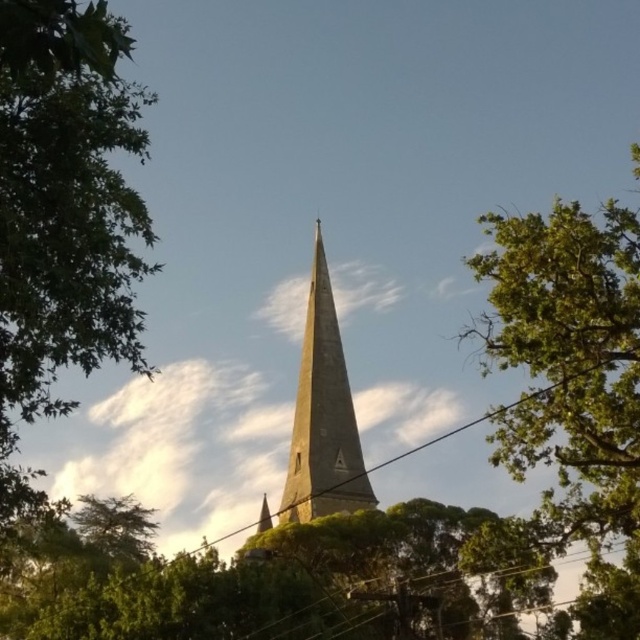
Question: Considering the real-world distances, which object is farthest from the smooth stone spire at center?

Choices:
 (A) green leafy tree at upper right
 (B) green leafy tree at left

Answer: (B)

Question: Based on their relative distances, which object is farther from the smooth stone spire at center?

Choices:
 (A) green leafy tree at upper right
 (B) green leafy tree at left

Answer: (B)

Question: Which point is farther from the camera taking this photo?

Choices:
 (A) (502, 237)
 (B) (58, 282)
 (C) (294, 445)

Answer: (C)

Question: Can you confirm if green leafy tree at left is wider than smooth stone spire at center?

Choices:
 (A) no
 (B) yes

Answer: (B)

Question: Can you confirm if green leafy tree at upper right is positioned to the left of smooth stone spire at center?

Choices:
 (A) no
 (B) yes

Answer: (A)

Question: Does green leafy tree at left have a smaller size compared to green leafy tree at upper right?

Choices:
 (A) yes
 (B) no

Answer: (A)